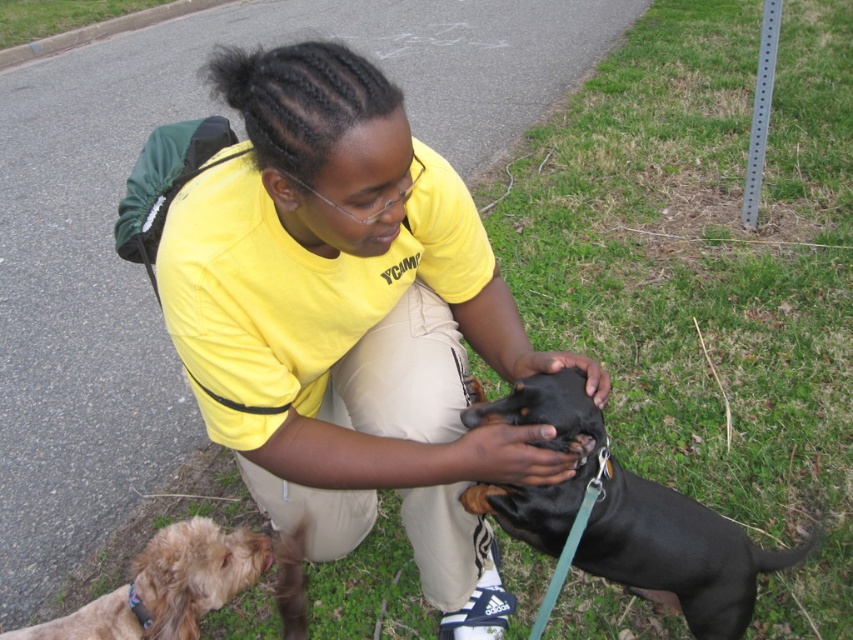
Question: Does black smooth dog at center come behind light brown fur at lower left?

Choices:
 (A) no
 (B) yes

Answer: (A)

Question: Is yellow cotton shirt at center bigger than black smooth dog at center?

Choices:
 (A) no
 (B) yes

Answer: (B)

Question: Which of these objects is positioned closest to the yellow cotton shirt at center?

Choices:
 (A) black smooth dog at center
 (B) light brown fur at lower left

Answer: (A)

Question: Which is farther from the light brown fur at lower left?

Choices:
 (A) black smooth dog at center
 (B) yellow cotton shirt at center

Answer: (A)

Question: Among these points, which one is farthest from the camera?

Choices:
 (A) (543, 529)
 (B) (235, 310)

Answer: (A)

Question: Can you confirm if yellow cotton shirt at center is positioned above black smooth dog at center?

Choices:
 (A) yes
 (B) no

Answer: (A)